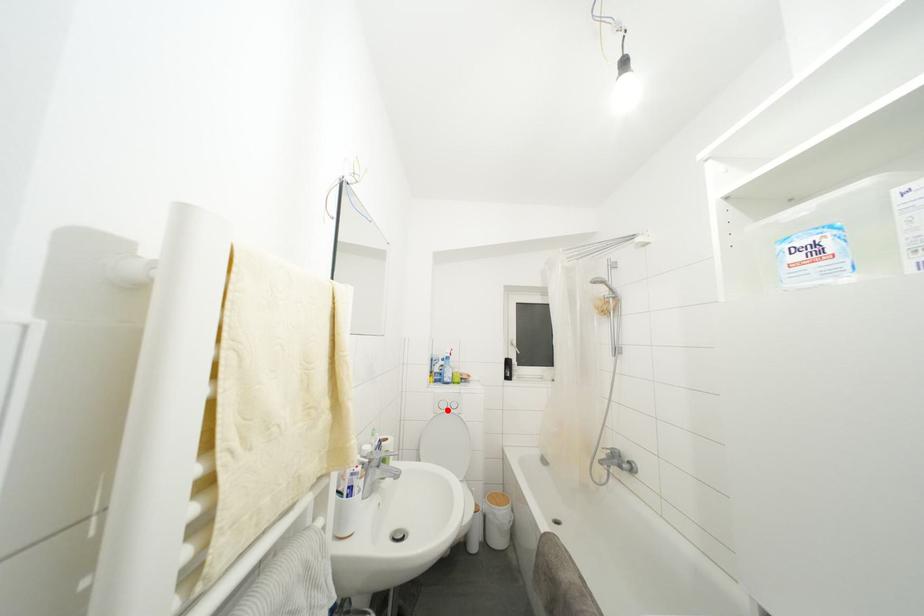
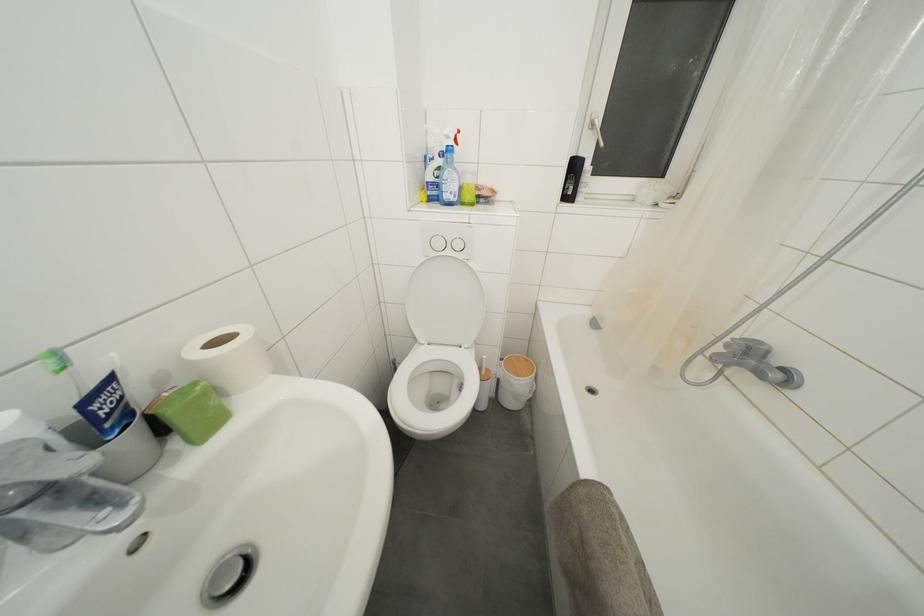
Where in the second image is the point corresponding to the highlighted location from the first image?

(443, 249)